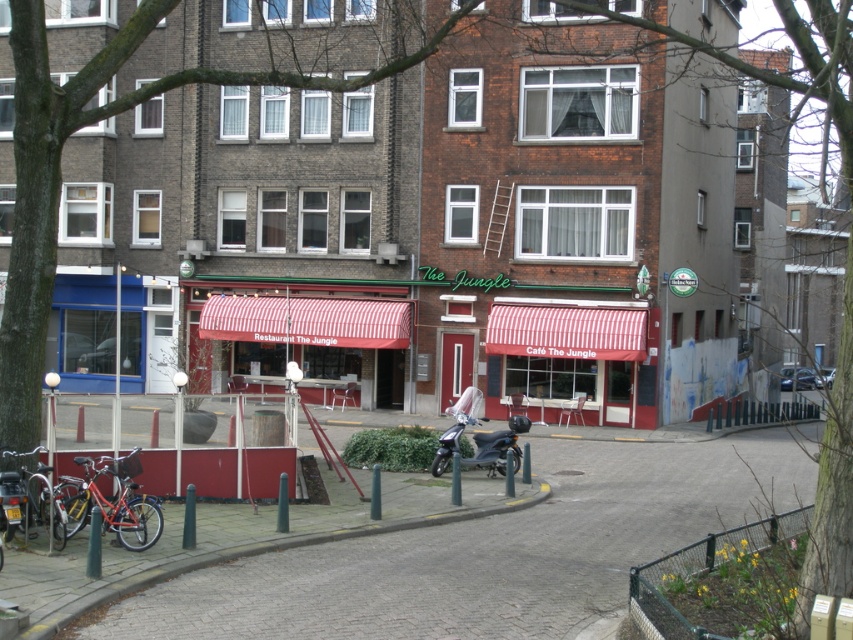
Please describe the exact position of the red striped awning at center in the image using coordinates.

The red striped awning at center is located at coordinates point [306,321].

You are a delivery person standing in front of the urban street scene. You need to place a box on top of the red striped awning at center and the matte red bicycle at lower left. Which object can the box be placed on top of?

The box can be placed on top of the red striped awning at center because it has a greater height compared to the matte red bicycle at lower left.